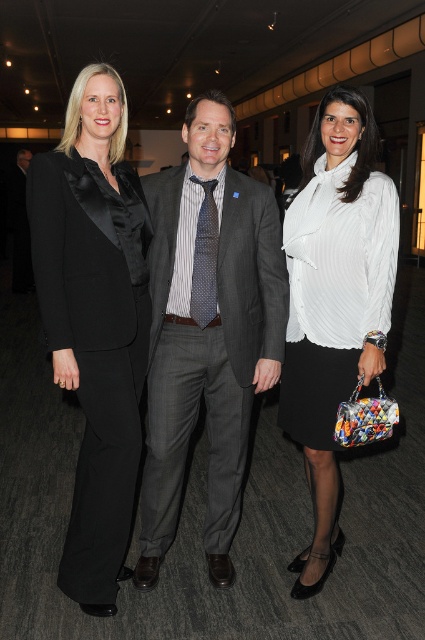
Question: Can you confirm if gray pinstripe suit at center is smaller than polka dot silk tie at center?

Choices:
 (A) no
 (B) yes

Answer: (A)

Question: Which of the following is the closest to the observer?

Choices:
 (A) (176, 344)
 (B) (16, 275)
 (C) (104, 180)

Answer: (C)

Question: Is white pleated blouse at center bigger than dark gray suit at center?

Choices:
 (A) yes
 (B) no

Answer: (B)

Question: Among these points, which one is nearest to the camera?

Choices:
 (A) (122, 170)
 (B) (11, 288)

Answer: (A)

Question: Which is nearer to the polka dot silk tie at center?

Choices:
 (A) white pleated blouse at center
 (B) black satin suit at left
 (C) gray pinstripe suit at center
 (D) dark gray suit at center

Answer: (C)

Question: Can you confirm if gray pinstripe suit at center is wider than black satin suit at left?

Choices:
 (A) no
 (B) yes

Answer: (B)